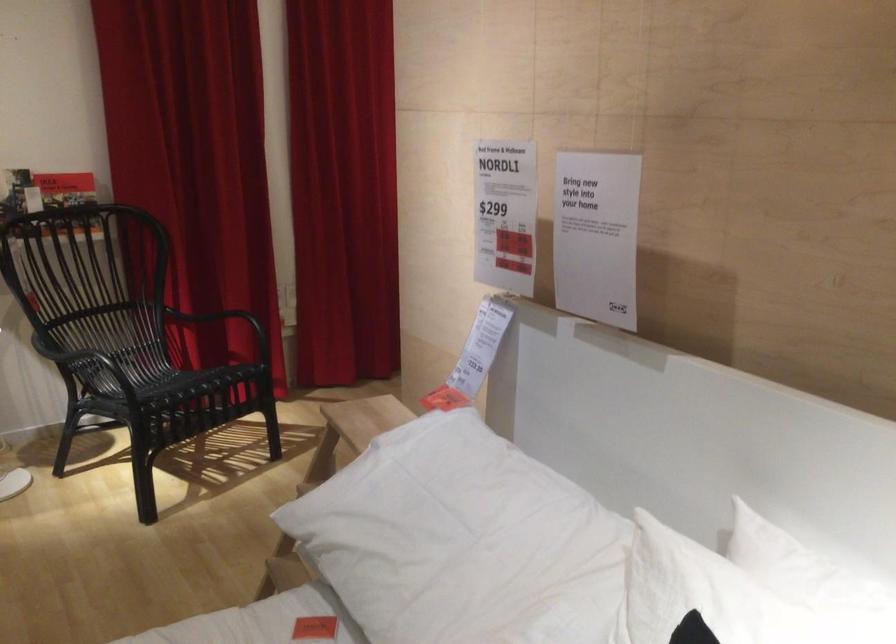
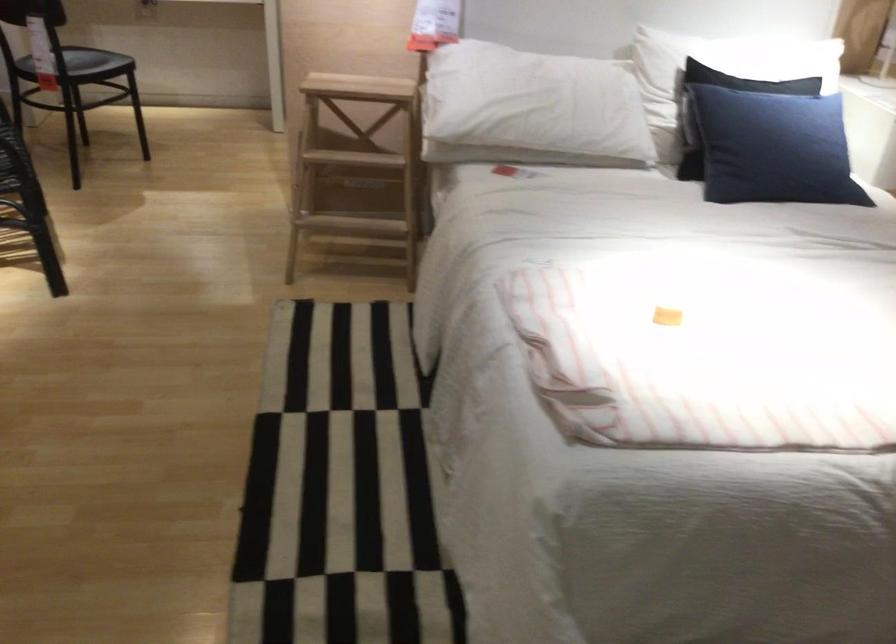
Locate, in the second image, the point that corresponds to point (409, 565) in the first image.

(531, 108)